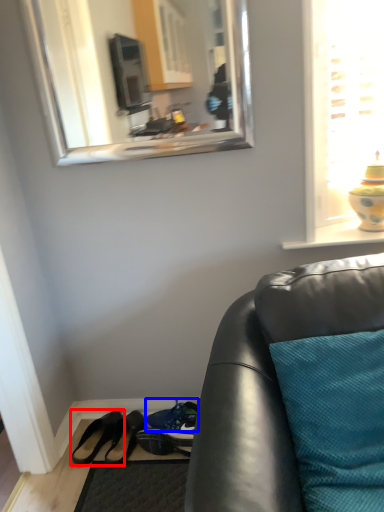
Question: Which object is further to the camera taking this photo, footwear (highlighted by a red box) or shoe (highlighted by a blue box)?

Choices:
 (A) footwear
 (B) shoe

Answer: (B)